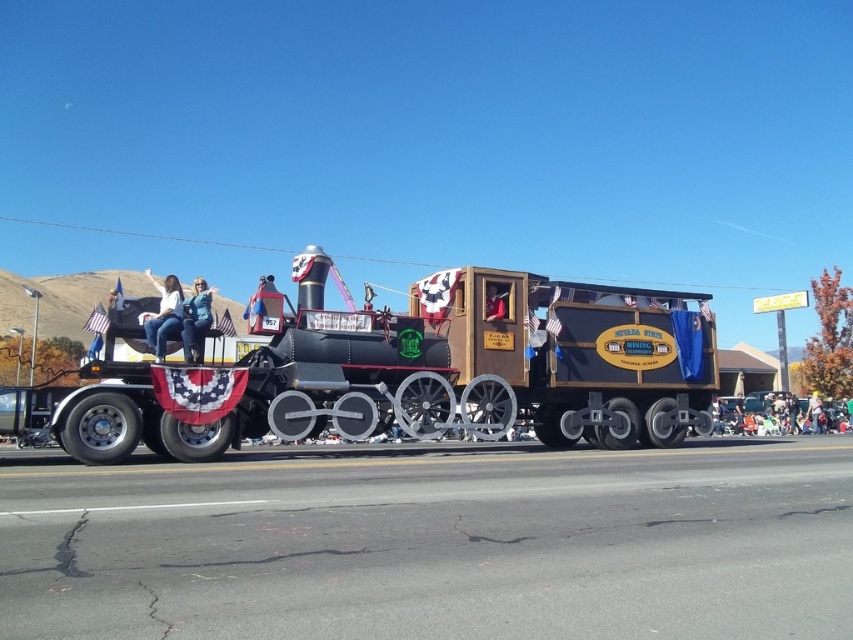
Question: Estimate the real-world distances between objects in this image. Which object is farther from the white fabric pants at left?

Choices:
 (A) red fabric at center
 (B) shiny black locomotive at center
 (C) light brown leather jacket at center

Answer: (C)

Question: Does shiny black locomotive at center appear on the left side of white fabric pants at left?

Choices:
 (A) no
 (B) yes

Answer: (A)

Question: Is red fabric at center behind light brown leather jacket at center?

Choices:
 (A) yes
 (B) no

Answer: (B)

Question: Which point is closer to the camera?

Choices:
 (A) light brown leather jacket at center
 (B) red fabric at center

Answer: (B)

Question: Does white fabric pants at left have a greater width compared to red fabric at center?

Choices:
 (A) no
 (B) yes

Answer: (B)

Question: Which point is closer to the camera?

Choices:
 (A) (819, 404)
 (B) (172, 276)
 (C) (581, 401)

Answer: (C)